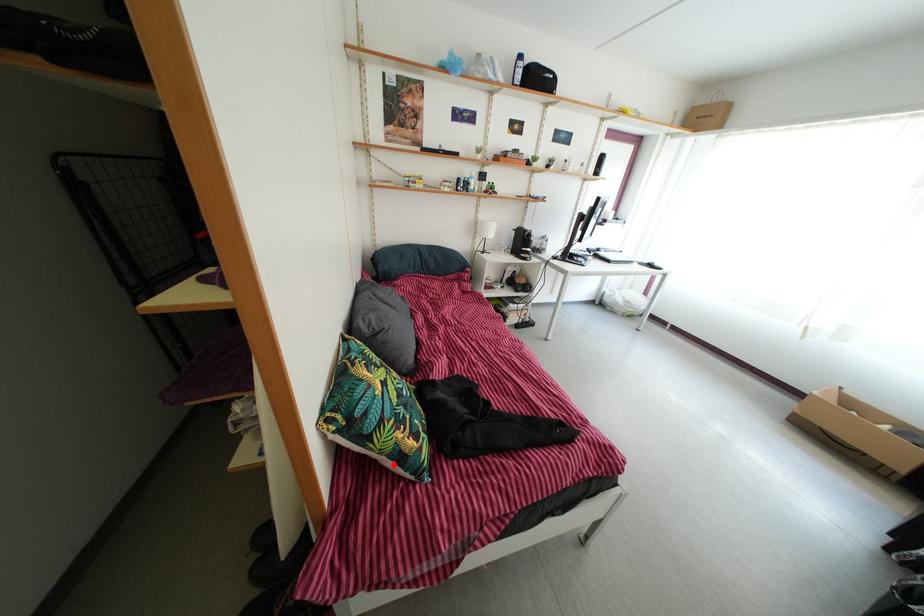
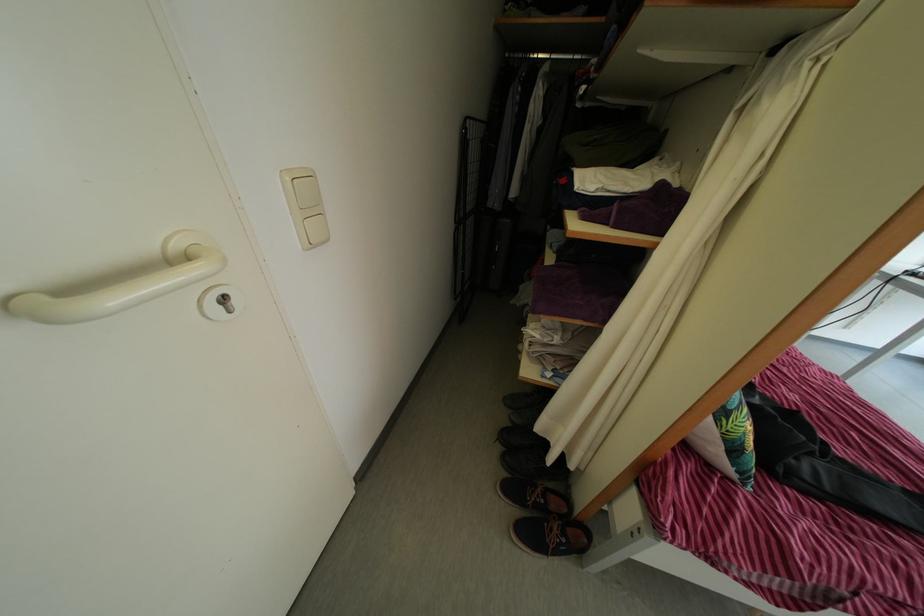
The point at the highlighted location is marked in the first image. Where is the corresponding point in the second image?

(732, 448)